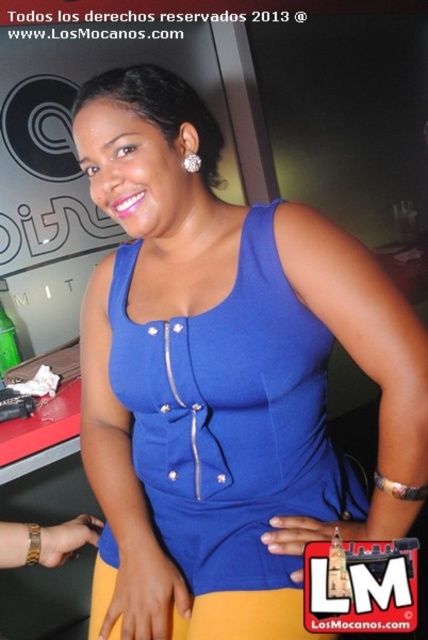
Question: Is blue fabric dress at center positioned before green glass bottle at left?

Choices:
 (A) no
 (B) yes

Answer: (B)

Question: Which of these objects is positioned closest to the blue fabric dress at center?

Choices:
 (A) green glass bottle at left
 (B) diamondelegantearring at upper left

Answer: (B)

Question: Which of the following is the closest to the observer?

Choices:
 (A) green glass bottle at left
 (B) blue fabric dress at center

Answer: (B)

Question: Is blue fabric dress at center behind green glass bottle at left?

Choices:
 (A) yes
 (B) no

Answer: (B)

Question: Among these objects, which one is farthest from the camera?

Choices:
 (A) green glass bottle at left
 (B) blue fabric dress at center
 (C) diamondelegantearring at upper left

Answer: (A)

Question: In this image, where is blue fabric dress at center located relative to diamondelegantearring at upper left?

Choices:
 (A) above
 (B) below

Answer: (B)